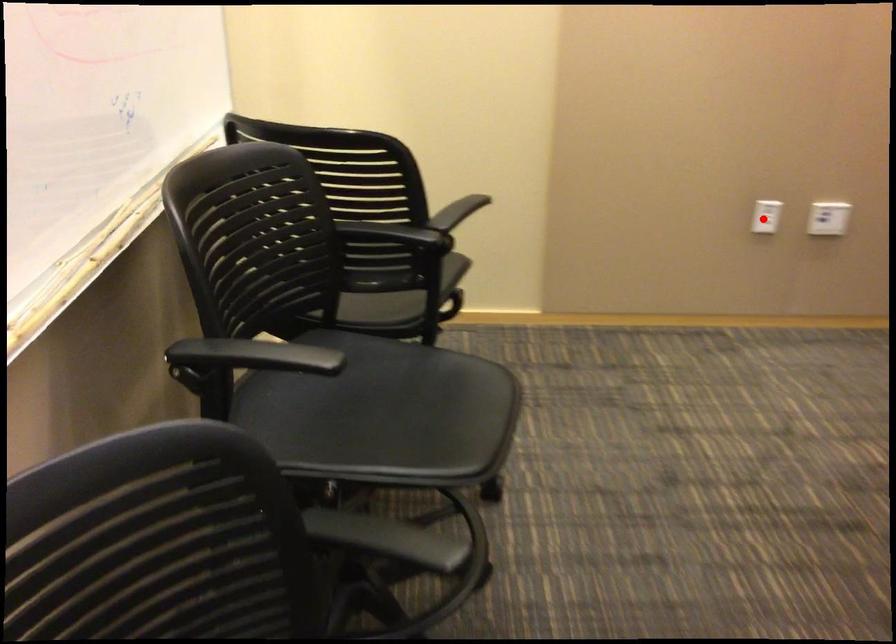
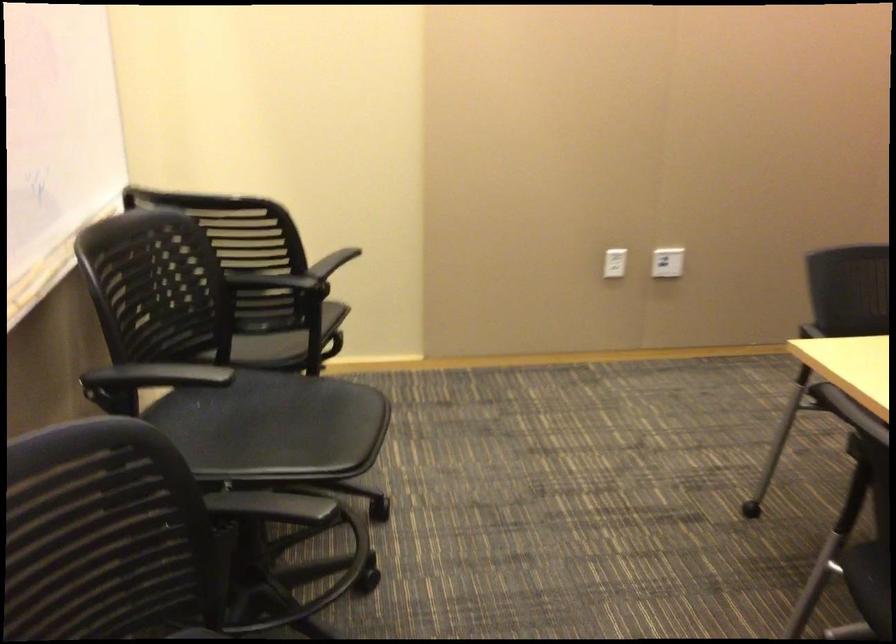
Question: I am providing you with two images of the same scene from different viewpoints. Image1 has a red point marked. In image2, the corresponding 3D location appears at what relative position? Reply with the corresponding letter.

Choices:
 (A) Closer
 (B) Farther

Answer: (B)